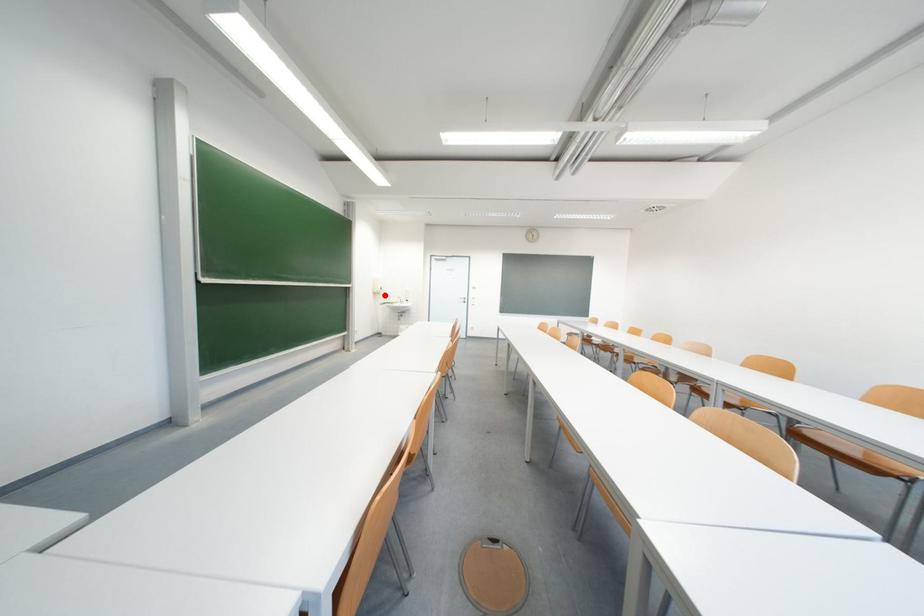
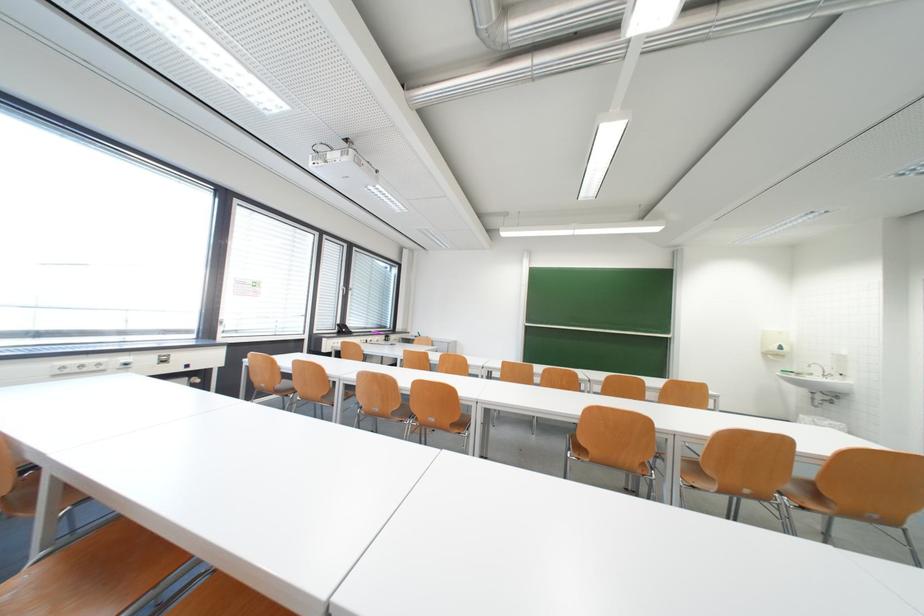
Where in the second image is the point corresponding to the highlighted location from the first image?

(784, 357)